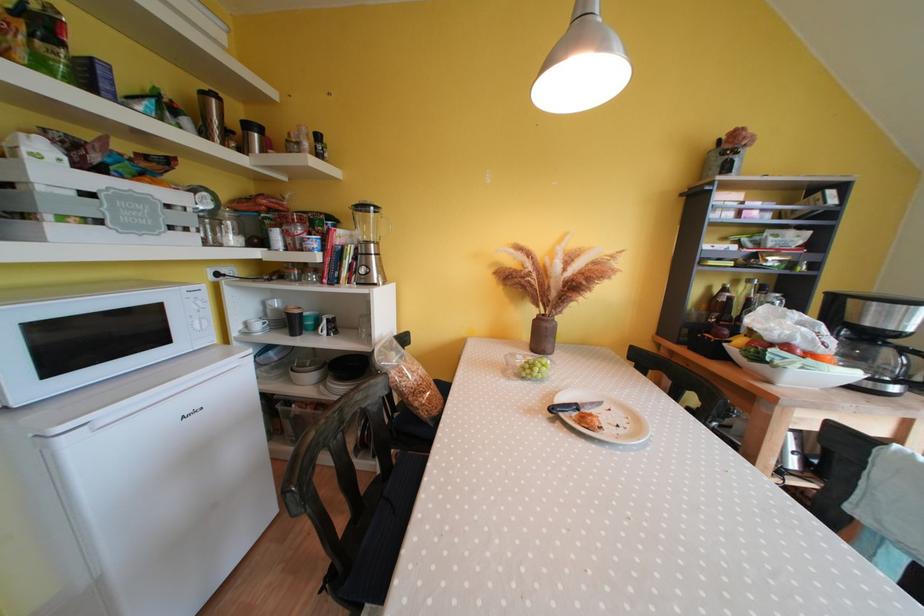
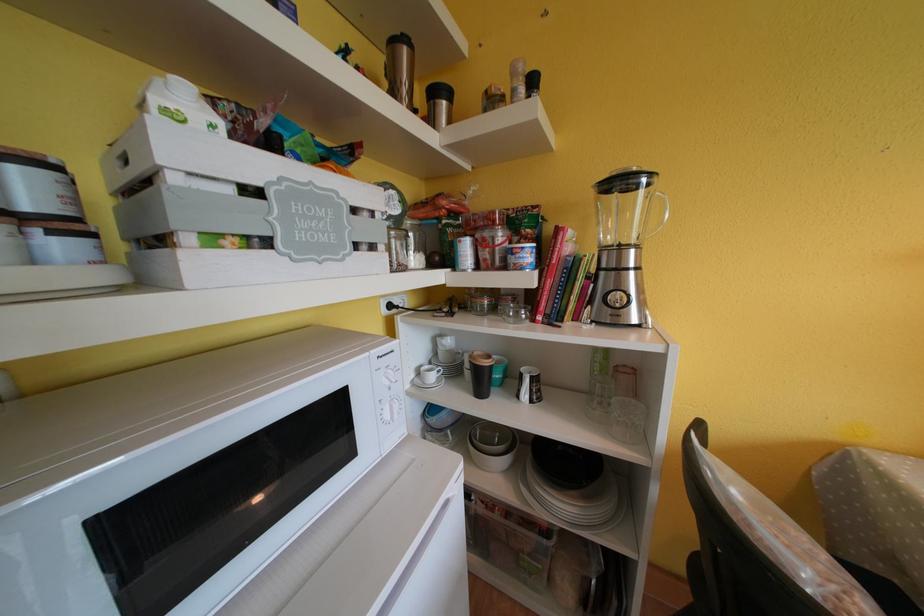
The point at (209, 98) is marked in the first image. Where is the corresponding point in the second image?

(399, 46)